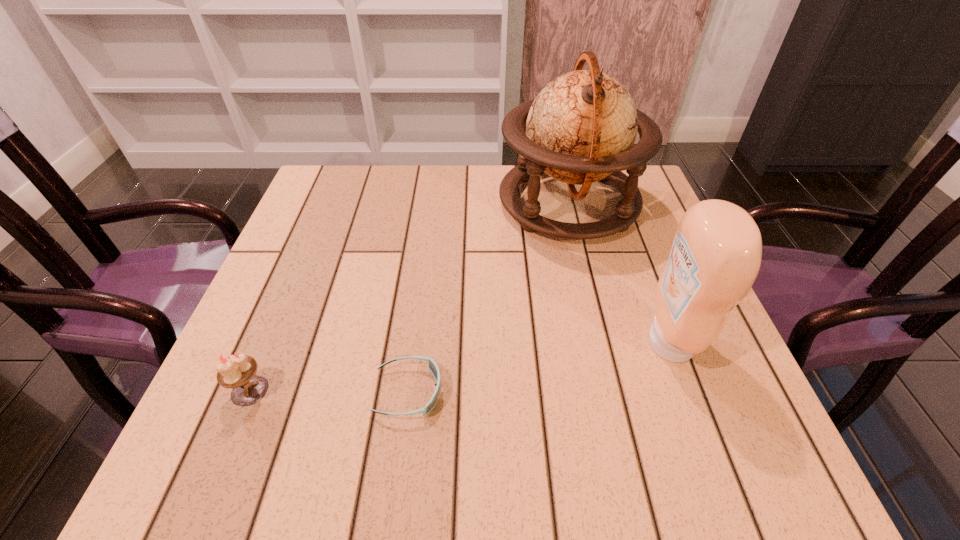
Where is `free spot at the near edge of the desktop`? The width and height of the screenshot is (960, 540). free spot at the near edge of the desktop is located at coordinates (459, 462).

In the image, there is a desktop. Find the location of `vacant space at the left edge`. vacant space at the left edge is located at coordinates (264, 350).

This screenshot has height=540, width=960. I want to click on vacant space at the right edge of the desktop, so click(x=622, y=296).

Where is `free location at the far right corner`? This screenshot has width=960, height=540. free location at the far right corner is located at coordinates (594, 201).

Where is `free spot at the near right corner of the desktop`? free spot at the near right corner of the desktop is located at coordinates (765, 449).

Where is `unoccupied area between the condiment and the tallest object`? This screenshot has width=960, height=540. unoccupied area between the condiment and the tallest object is located at coordinates (619, 272).

Locate an element on the screen. This screenshot has height=540, width=960. free space between the tallest object and the leftmost object is located at coordinates (409, 296).

You are a GUI agent. You are given a task and a screenshot of the screen. Output one action in this format:
    pyautogui.click(x=<x>, y=<y>)
    Task: Click on the blank region between the tallest object and the third shortest object
    
    Given the screenshot: What is the action you would take?
    pyautogui.click(x=619, y=272)

You are a GUI agent. You are given a task and a screenshot of the screen. Output one action in this format:
    pyautogui.click(x=<x>, y=<y>)
    Task: Click on the empty space that is in between the third tallest object and the tallest object
    This screenshot has height=540, width=960.
    Given the screenshot: What is the action you would take?
    pyautogui.click(x=409, y=296)

The height and width of the screenshot is (540, 960). What are the coordinates of `empty space between the second shortest object and the condiment` in the screenshot? It's located at (460, 367).